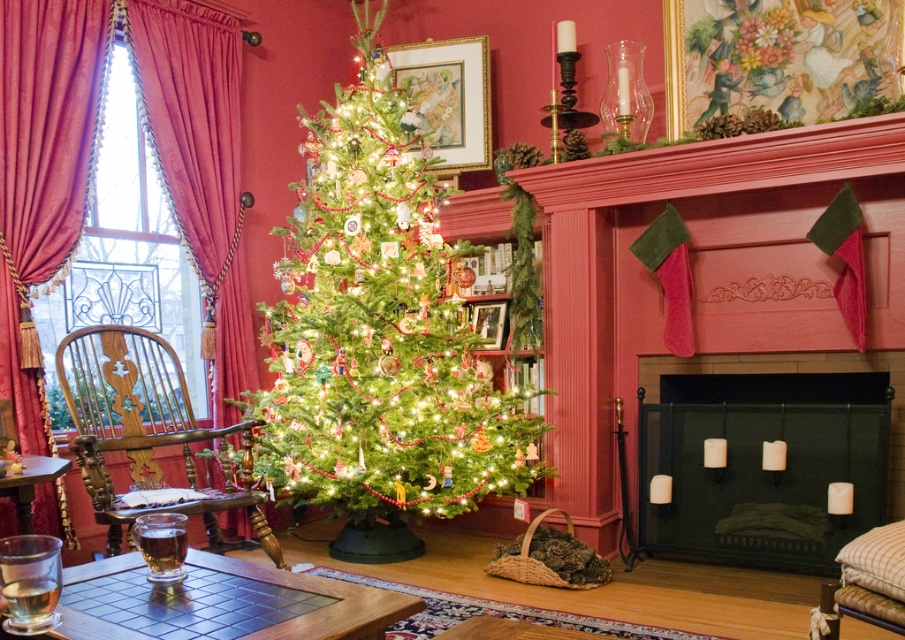
Can you confirm if green matte christmas tree at center is smaller than woodenwoodenarmchair at left?

Incorrect, green matte christmas tree at center is not smaller in size than woodenwoodenarmchair at left.

The height and width of the screenshot is (640, 905). What do you see at coordinates (378, 332) in the screenshot?
I see `green matte christmas tree at center` at bounding box center [378, 332].

Between point (399, 385) and point (160, 369), which one is positioned behind?

The point (160, 369) is behind.

Locate an element on the screen. Image resolution: width=905 pixels, height=640 pixels. green matte christmas tree at center is located at coordinates (378, 332).

Is black metal fireplace at center above velvet curtain at left?

Actually, black metal fireplace at center is below velvet curtain at left.

Measure the distance between black metal fireplace at center and camera.

They are 3.06 meters apart.

Which is behind, point (863, 464) or point (13, 240)?

Point (13, 240)

Locate an element on the screen. black metal fireplace at center is located at coordinates click(760, 451).

In the scene shown: Between green matte christmas tree at center and velvet curtain at left, which one is positioned higher?

green matte christmas tree at center is above.

Does green matte christmas tree at center appear over velvet curtain at left?

Indeed, green matte christmas tree at center is positioned over velvet curtain at left.

Find the location of `green matte christmas tree at center`. green matte christmas tree at center is located at coordinates (378, 332).

In order to click on green matte christmas tree at center in this screenshot , I will do `click(378, 332)`.